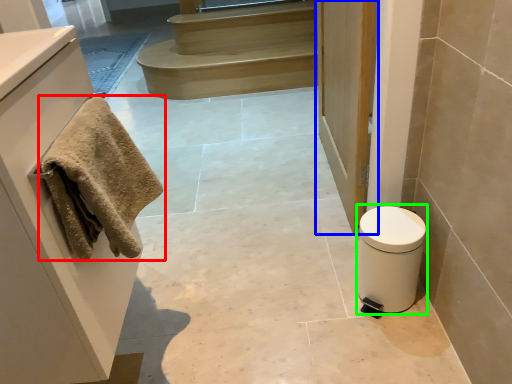
Question: Which object is the closest to the towel (highlighted by a red box)? Choose among these: door (highlighted by a blue box) or toilet bowl (highlighted by a green box).

Choices:
 (A) door
 (B) toilet bowl

Answer: (B)